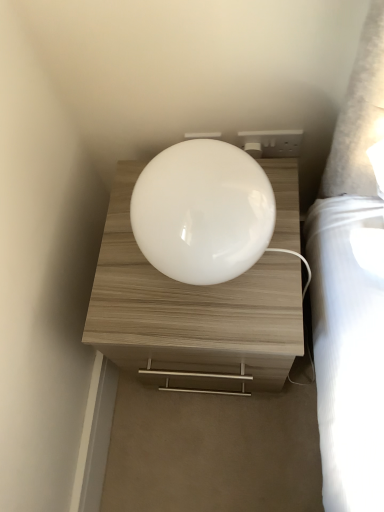
The width and height of the screenshot is (384, 512). Find the location of `free space in front of white glossy lampshade at center`. free space in front of white glossy lampshade at center is located at coordinates (230, 325).